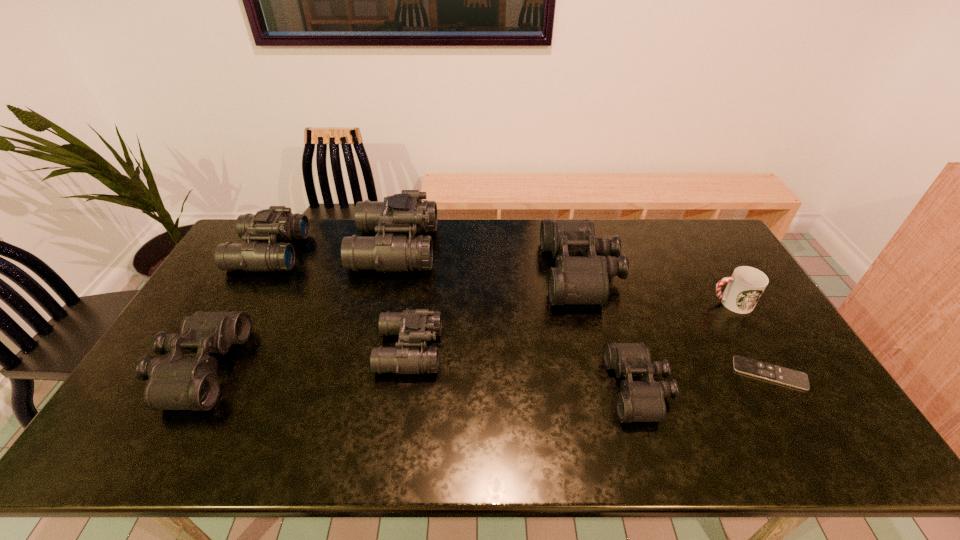
You are a GUI agent. You are given a task and a screenshot of the screen. Output one action in this format:
    pyautogui.click(x=<x>, y=<y>)
    Task: Click on the empty space between the cup and the nearest blue binoculars
    
    Given the screenshot: What is the action you would take?
    pyautogui.click(x=570, y=326)

The height and width of the screenshot is (540, 960). In order to click on empty location between the tallest object and the leftmost blue binoculars in this screenshot , I will do `click(332, 250)`.

Select which object appears as the sixth closest to the leftmost black binoculars. Please provide its 2D coordinates. Your answer should be formatted as a tuple, i.e. [(x, y)], where the tuple contains the x and y coordinates of a point satisfying the conditions above.

[(755, 368)]

Where is `object that can be found as the fourth closest to the second smallest black binoculars`? This screenshot has width=960, height=540. object that can be found as the fourth closest to the second smallest black binoculars is located at coordinates (582, 267).

The height and width of the screenshot is (540, 960). I want to click on binoculars that is the second nearest to the tallest binoculars, so click(x=276, y=223).

The height and width of the screenshot is (540, 960). I want to click on the fifth closest binoculars to the smallest blue binoculars, so click(x=639, y=401).

Identify which blue binoculars is the third closest to the smallest black binoculars. Please provide its 2D coordinates. Your answer should be formatted as a tuple, i.e. [(x, y)], where the tuple contains the x and y coordinates of a point satisfying the conditions above.

[(276, 223)]

Where is `blue binoculars that is the second nearest to the tallest object`? blue binoculars that is the second nearest to the tallest object is located at coordinates (276, 223).

Point out which black binoculars is positioned as the third nearest to the remote control. Please provide its 2D coordinates. Your answer should be formatted as a tuple, i.e. [(x, y)], where the tuple contains the x and y coordinates of a point satisfying the conditions above.

[(174, 383)]

Select which black binoculars is the second closest to the tallest object. Please provide its 2D coordinates. Your answer should be formatted as a tuple, i.e. [(x, y)], where the tuple contains the x and y coordinates of a point satisfying the conditions above.

[(582, 267)]